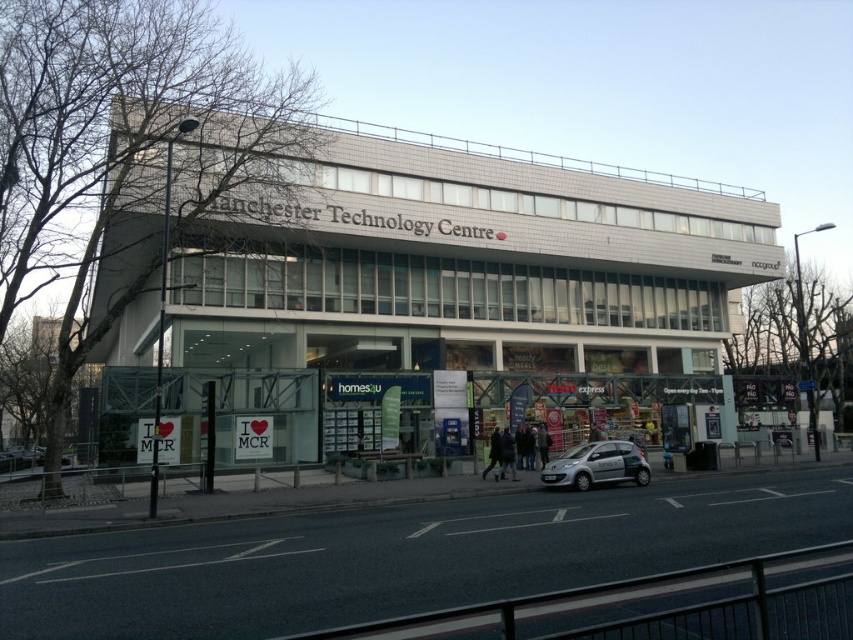
You are a delivery driver who needs to park your silver metallic car at center as close as possible to the white glass building at center. Given that the parking space available is 30 meters away from the building, can you park your car in this space and still be within the required proximity?

The distance between the white glass building at center and the silver metallic car at center is 26.28 meters. Since the parking space is 30 meters away, the car can be parked there and still be within the required proximity as 26.28 meters is less than 30 meters.

Based on the photo, you are standing at the entrance of the Tesco Express store and want to go to the white glass building at center. Which direction should you head towards?

The white glass building at center is located at point (465, 268), so you should head towards the center direction from the Tesco Express store to reach it.

You are standing on the sidewalk in front of the Manchester Technology Centre. You see a white glass building at center and a silver metallic car at center. Which one is positioned to the left?

The white glass building at center is positioned to the left of the silver metallic car at center.